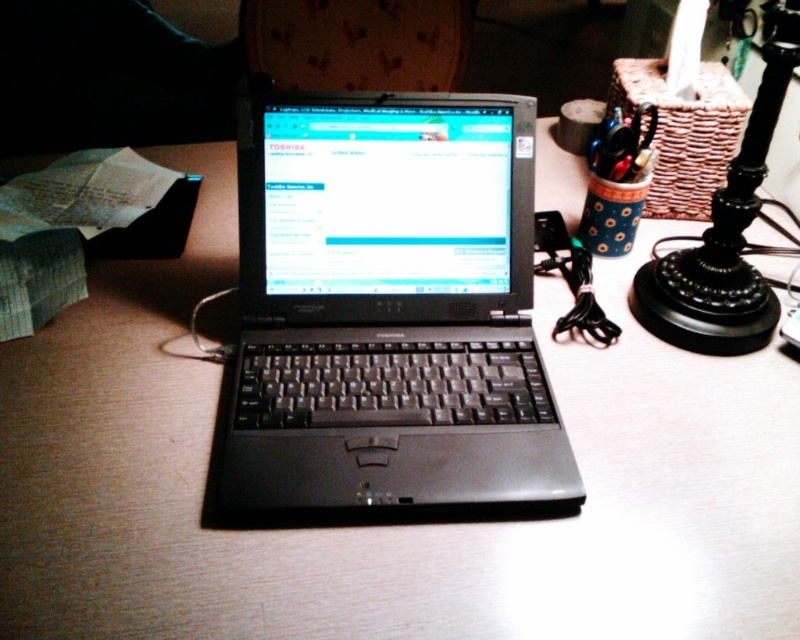
You are organizing a desk and need to place a new A4 paper sheet that is 21 cm wide. You have the black plastic laptop at center and the black metal lamp at upper right. Which object has enough width to place the paper without overlapping?

The black plastic laptop at center has a width larger than the black metal lamp at upper right, so it can accommodate the 21 cm wide A4 paper sheet without overlapping.

You are organizing your desk and need to move the black metal lamp at upper right closer to you. The black plastic laptop at center is currently in the way. Can you slide the laptop out of the way to make space for the lamp?

The black plastic laptop at center is closer to the viewer than the black metal lamp at upper right, so you can slide the laptop out of the way to make space for the lamp.

You are a delivery robot approaching the workspace. The delivery point is at coordinates point (316, 214). If your arm can reach up to 30 inches, will you be able to place the package at the delivery point?

The distance of point (316, 214) from camera is 32.11 inches, so the delivery robot cannot reach the delivery point as its arm can only extend up to 30 inches.